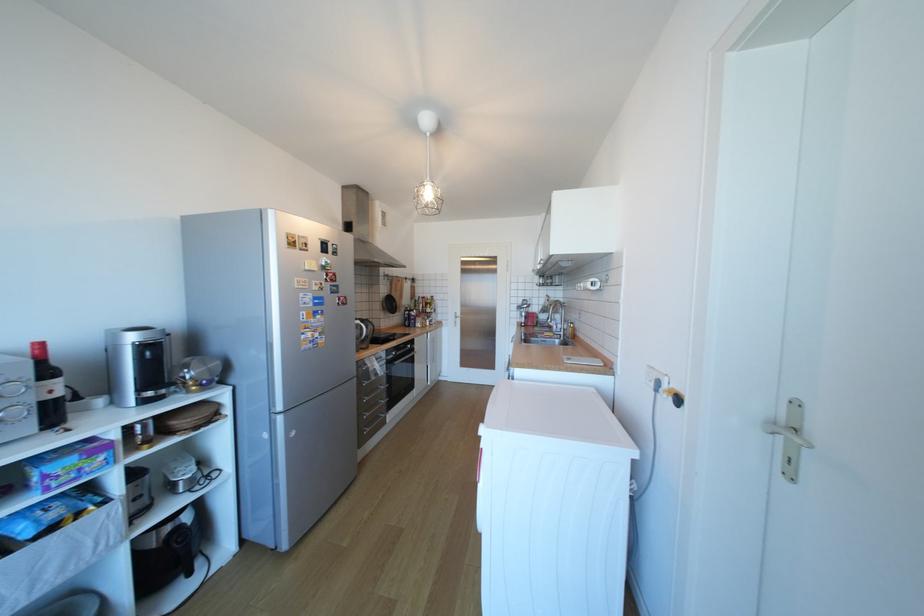
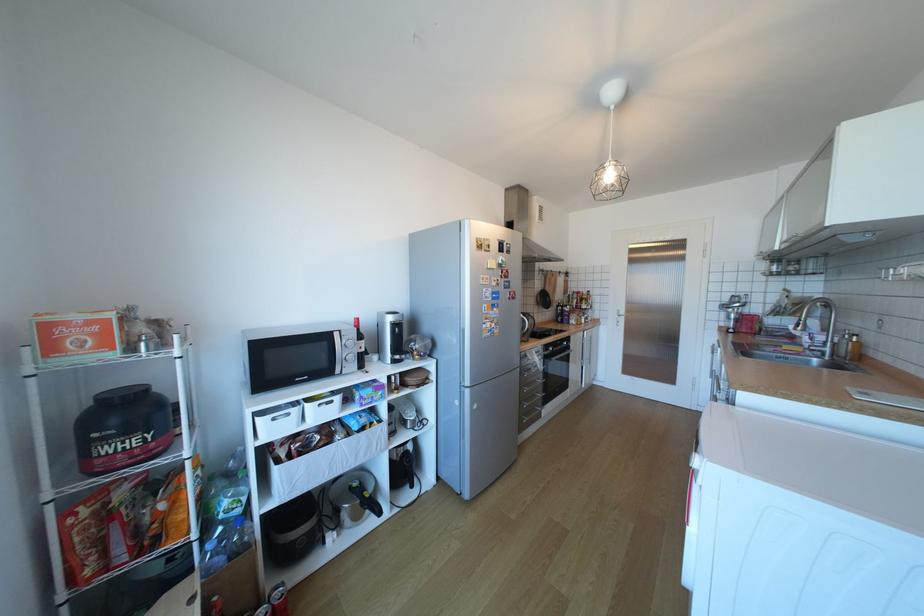
In the second image, find the point that corresponds to pixel 370 431 in the first image.

(529, 419)